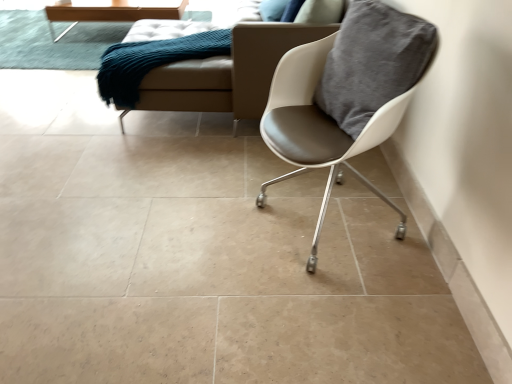
Question: Should I look upward or downward to see teal knitted mat at upper left?

Choices:
 (A) up
 (B) down

Answer: (A)

Question: Considering the relative positions of teal knitted mat at upper left and white leather chair at right in the image provided, is teal knitted mat at upper left to the left of white leather chair at right from the viewer's perspective?

Choices:
 (A) yes
 (B) no

Answer: (A)

Question: Can you confirm if teal knitted mat at upper left is thinner than white leather chair at right?

Choices:
 (A) no
 (B) yes

Answer: (A)

Question: Is white leather chair at right at the back of teal knitted mat at upper left?

Choices:
 (A) no
 (B) yes

Answer: (A)

Question: From a real-world perspective, is teal knitted mat at upper left located beneath white leather chair at right?

Choices:
 (A) yes
 (B) no

Answer: (A)

Question: Is teal knitted mat at upper left aimed at white leather chair at right?

Choices:
 (A) no
 (B) yes

Answer: (A)

Question: Is teal knitted mat at upper left closer to the viewer compared to white leather chair at right?

Choices:
 (A) yes
 (B) no

Answer: (B)

Question: Can you confirm if teal fabric couch at upper left is positioned to the left of beige leather couch at upper center?

Choices:
 (A) no
 (B) yes

Answer: (B)

Question: Does teal fabric couch at upper left have a greater width compared to beige leather couch at upper center?

Choices:
 (A) yes
 (B) no

Answer: (B)

Question: Does teal fabric couch at upper left have a lesser width compared to beige leather couch at upper center?

Choices:
 (A) no
 (B) yes

Answer: (B)

Question: Does teal fabric couch at upper left have a lesser height compared to beige leather couch at upper center?

Choices:
 (A) no
 (B) yes

Answer: (B)

Question: Is teal fabric couch at upper left completely or partially outside of beige leather couch at upper center?

Choices:
 (A) no
 (B) yes

Answer: (A)

Question: Is teal fabric couch at upper left at the right side of beige leather couch at upper center?

Choices:
 (A) no
 (B) yes

Answer: (A)

Question: Can you confirm if wooden table at upper left is positioned to the left of white leather chair at right?

Choices:
 (A) yes
 (B) no

Answer: (A)